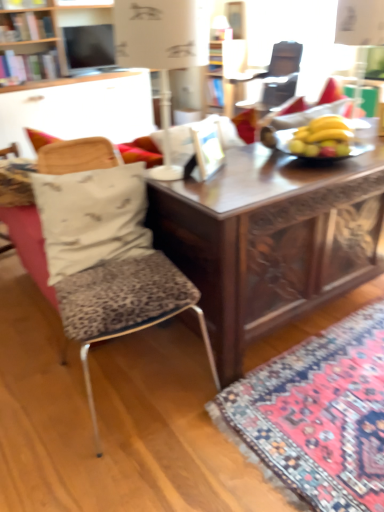
Image resolution: width=384 pixels, height=512 pixels. I want to click on vacant space underneath leopard print fabric chair at left (from a real-world perspective), so click(x=141, y=384).